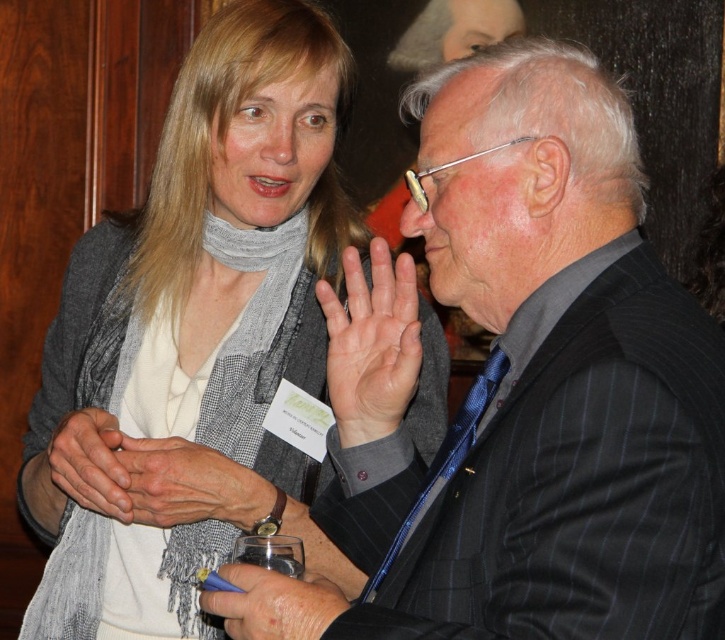
Is smooth skin hand at center taller than smooth beige scarf at lower left?

In fact, smooth skin hand at center may be shorter than smooth beige scarf at lower left.

Does smooth skin hand at center appear over smooth beige scarf at lower left?

Incorrect, smooth skin hand at center is not positioned above smooth beige scarf at lower left.

Identify the location of smooth skin hand at center. The height and width of the screenshot is (640, 725). (273, 604).

You are a GUI agent. You are given a task and a screenshot of the screen. Output one action in this format:
    pyautogui.click(x=<x>, y=<y>)
    Task: Click on the smooth skin hand at center
    This screenshot has height=640, width=725.
    Given the screenshot: What is the action you would take?
    pyautogui.click(x=273, y=604)

Find the location of a particular element. This screenshot has width=725, height=640. smooth beige scarf at center is located at coordinates (186, 483).

Who is more distant from viewer, (157, 525) or (207, 605)?

Positioned behind is point (157, 525).

You are a GUI agent. You are given a task and a screenshot of the screen. Output one action in this format:
    pyautogui.click(x=<x>, y=<y>)
    Task: Click on the smooth beige scarf at center
    This screenshot has width=725, height=640.
    Given the screenshot: What is the action you would take?
    pyautogui.click(x=186, y=483)

Which of these two, matte black suit at center or matte gray scarf at center, stands shorter?

matte black suit at center

Who is taller, matte black suit at center or matte gray scarf at center?

→ Standing taller between the two is matte gray scarf at center.

The image size is (725, 640). I want to click on matte black suit at center, so click(529, 381).

What are the coordinates of `matte black suit at center` in the screenshot? It's located at pos(529,381).